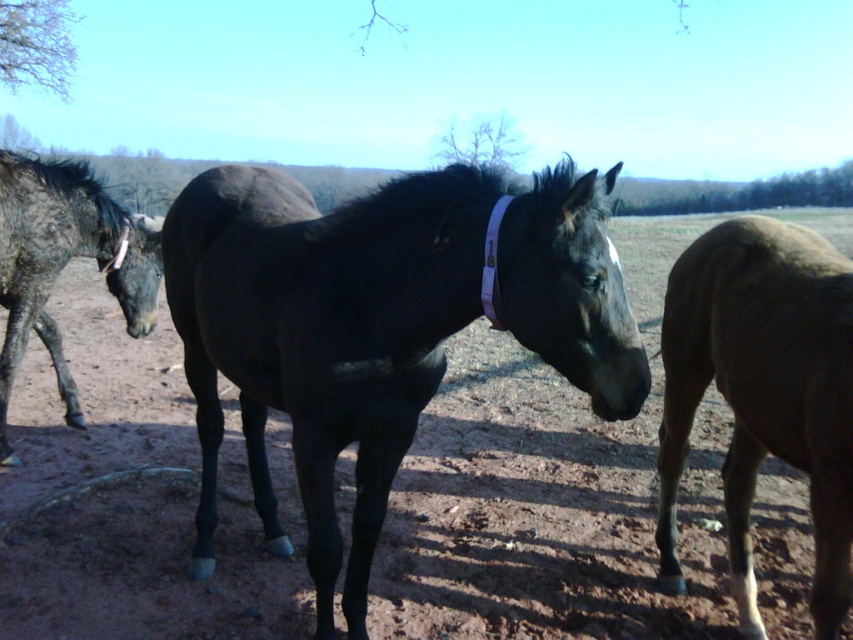
Question: Based on their relative distances, which object is farther from the black glossy horse at center?

Choices:
 (A) speckled dark fur horse at left
 (B) brown matte horse at right

Answer: (A)

Question: Estimate the real-world distances between objects in this image. Which object is closer to the speckled dark fur horse at left?

Choices:
 (A) brown matte horse at right
 (B) black glossy horse at center

Answer: (B)

Question: Which object appears farthest from the camera in this image?

Choices:
 (A) black glossy horse at center
 (B) speckled dark fur horse at left

Answer: (B)

Question: Is black glossy horse at center bigger than speckled dark fur horse at left?

Choices:
 (A) no
 (B) yes

Answer: (B)

Question: Does brown matte horse at right have a lesser width compared to speckled dark fur horse at left?

Choices:
 (A) no
 (B) yes

Answer: (B)

Question: Is black glossy horse at center to the right of speckled dark fur horse at left from the viewer's perspective?

Choices:
 (A) no
 (B) yes

Answer: (B)